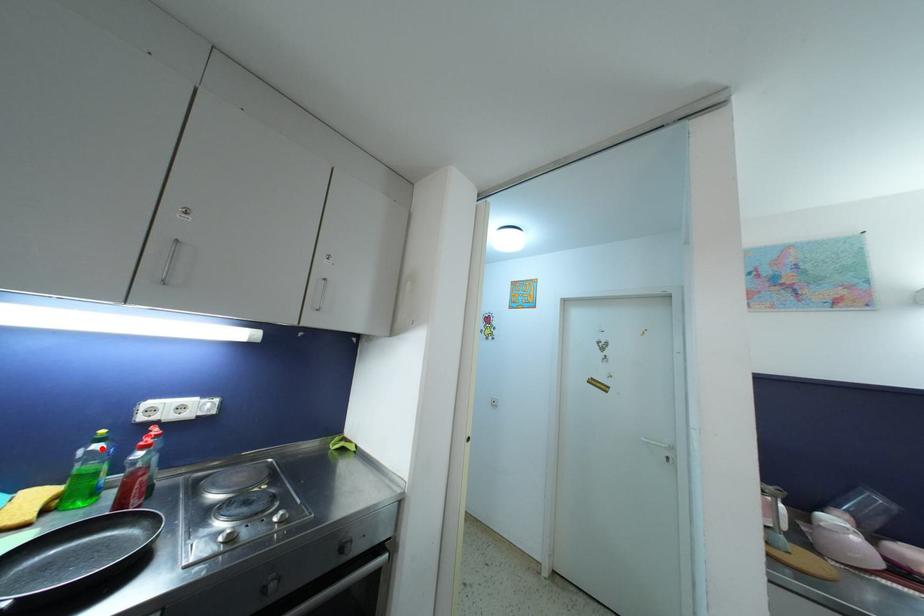
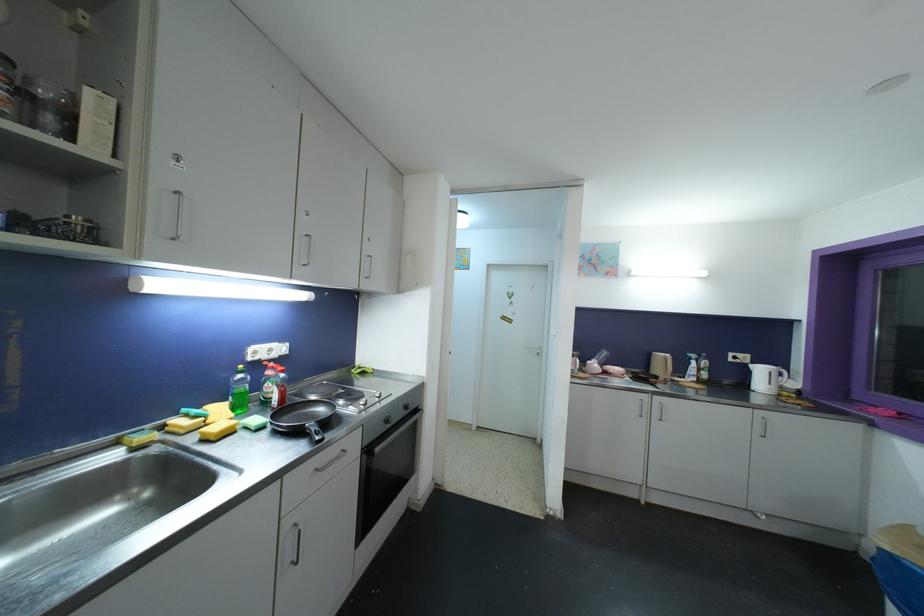
Find the pixel in the second image that matches the highlighted location in the first image.

(244, 379)